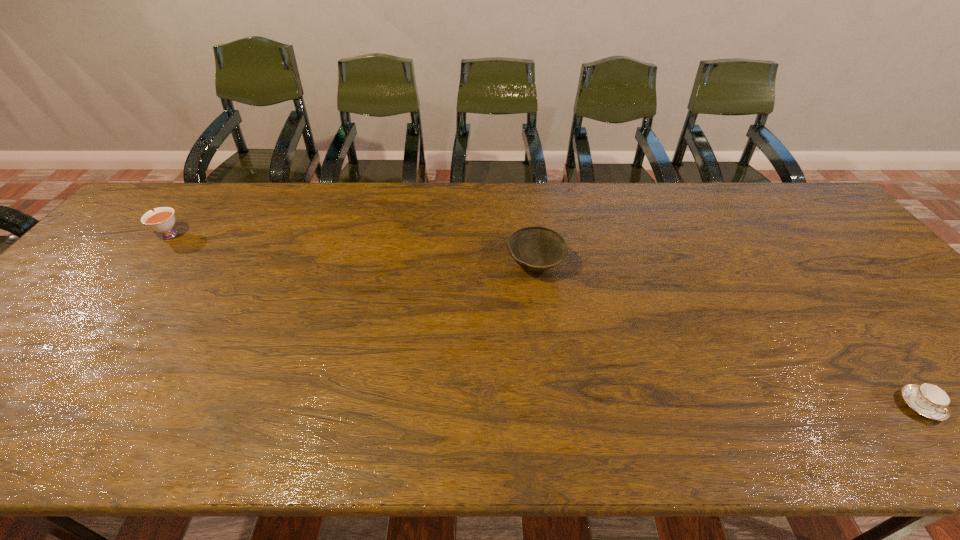
The image size is (960, 540). What are the coordinates of `vacant space that satisfies the following two spatial constraints: 1. on the side of the farthest object with the handle; 2. on the left side of the second object from right to left` in the screenshot? It's located at (143, 265).

Identify the location of vacant space that satisfies the following two spatial constraints: 1. on the side of the leftmost object with the handle; 2. on the back side of the bowl. (143, 265).

I want to click on free region that satisfies the following two spatial constraints: 1. on the side of the farthest object with the handle; 2. on the left side of the second farthest object, so click(143, 265).

Where is `free space that satisfies the following two spatial constraints: 1. on the side of the left teacup with the handle; 2. on the back side of the bowl`? This screenshot has height=540, width=960. free space that satisfies the following two spatial constraints: 1. on the side of the left teacup with the handle; 2. on the back side of the bowl is located at coordinates (143, 265).